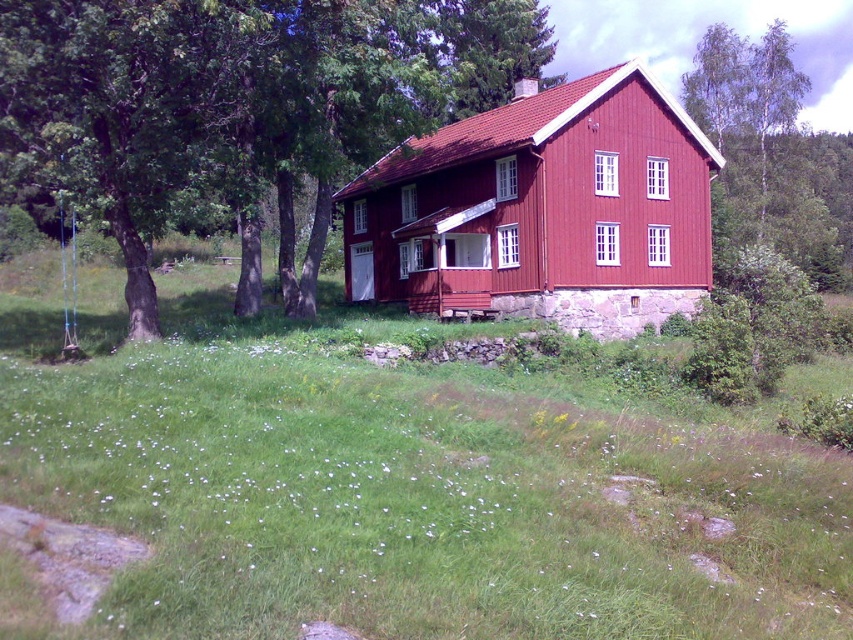
Which is below, green leafy tree at center or matte red wooden cabin at center?

matte red wooden cabin at center

Describe the element at coordinates (239, 106) in the screenshot. I see `green leafy tree at center` at that location.

Is point (120, 88) farther from camera compared to point (567, 138)?

No, it is in front of (567, 138).

The image size is (853, 640). Identify the location of green leafy tree at center. (239, 106).